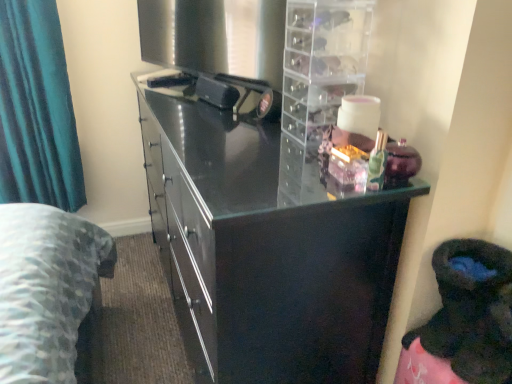
Question: From the image's perspective, relative to clear plastic drawer unit at upper right, is teal fabric curtain at left above or below?

Choices:
 (A) above
 (B) below

Answer: (A)

Question: Is teal fabric curtain at left in front of or behind clear plastic drawer unit at upper right in the image?

Choices:
 (A) behind
 (B) front

Answer: (A)

Question: Estimate the real-world distances between objects in this image. Which object is farther from the glossy black cupboard at center?

Choices:
 (A) clear plastic drawer unit at upper right
 (B) teal fabric curtain at left

Answer: (B)

Question: Estimate the real-world distances between objects in this image. Which object is farther from the teal fabric curtain at left?

Choices:
 (A) glossy black cupboard at center
 (B) clear plastic drawer unit at upper right

Answer: (B)